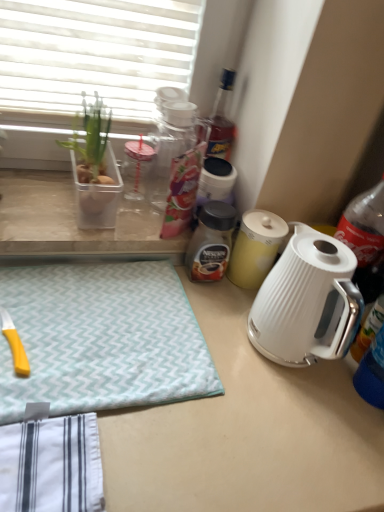
You are a GUI agent. You are given a task and a screenshot of the screen. Output one action in this format:
    pyautogui.click(x=<x>, y=<y>)
    Task: Click on the vacant region to the left of white glossy electric kettle at center-right
    The width and height of the screenshot is (384, 512).
    Given the screenshot: What is the action you would take?
    pyautogui.click(x=223, y=331)